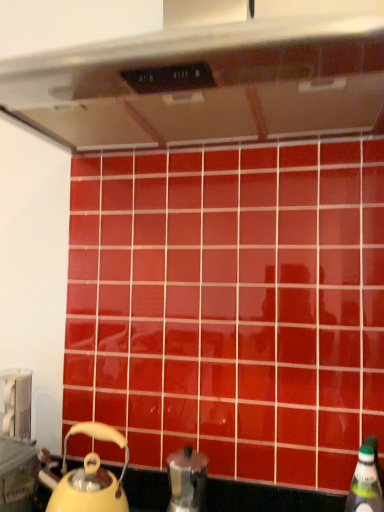
Question: Is the position of metallic silver coffee pot at lower center more distant than that of green plastic bottle at lower right?

Choices:
 (A) no
 (B) yes

Answer: (B)

Question: Considering the relative sizes of metallic silver coffee pot at lower center and green plastic bottle at lower right in the image provided, is metallic silver coffee pot at lower center thinner than green plastic bottle at lower right?

Choices:
 (A) no
 (B) yes

Answer: (A)

Question: Is green plastic bottle at lower right a part of metallic silver coffee pot at lower center?

Choices:
 (A) yes
 (B) no

Answer: (B)

Question: Can you confirm if metallic silver coffee pot at lower center is taller than green plastic bottle at lower right?

Choices:
 (A) no
 (B) yes

Answer: (A)

Question: From the image's perspective, would you say metallic silver coffee pot at lower center is positioned over green plastic bottle at lower right?

Choices:
 (A) no
 (B) yes

Answer: (B)

Question: Is yellow matte kettle at lower left taller or shorter than metallic silver coffee pot at lower center?

Choices:
 (A) tall
 (B) short

Answer: (A)

Question: Is point (72, 429) closer or farther from the camera than point (185, 445)?

Choices:
 (A) farther
 (B) closer

Answer: (B)

Question: Considering the positions of yellow matte kettle at lower left and metallic silver coffee pot at lower center in the image, is yellow matte kettle at lower left wider or thinner than metallic silver coffee pot at lower center?

Choices:
 (A) thin
 (B) wide

Answer: (B)

Question: Based on their sizes in the image, would you say yellow matte kettle at lower left is bigger or smaller than metallic silver coffee pot at lower center?

Choices:
 (A) big
 (B) small

Answer: (A)

Question: Considering the positions of satin silver exhaust hood at upper center and yellow matte kettle at lower left in the image, is satin silver exhaust hood at upper center wider or thinner than yellow matte kettle at lower left?

Choices:
 (A) thin
 (B) wide

Answer: (B)

Question: From the image's perspective, is satin silver exhaust hood at upper center positioned above or below yellow matte kettle at lower left?

Choices:
 (A) below
 (B) above

Answer: (B)

Question: Considering the positions of satin silver exhaust hood at upper center and yellow matte kettle at lower left in the image, is satin silver exhaust hood at upper center bigger or smaller than yellow matte kettle at lower left?

Choices:
 (A) big
 (B) small

Answer: (A)

Question: Is satin silver exhaust hood at upper center taller or shorter than yellow matte kettle at lower left?

Choices:
 (A) short
 (B) tall

Answer: (B)

Question: Based on their sizes in the image, would you say metallic silver toaster at lower left is bigger or smaller than metallic silver coffee pot at lower center?

Choices:
 (A) small
 (B) big

Answer: (A)

Question: From the image's perspective, relative to metallic silver coffee pot at lower center, is metallic silver toaster at lower left above or below?

Choices:
 (A) above
 (B) below

Answer: (A)